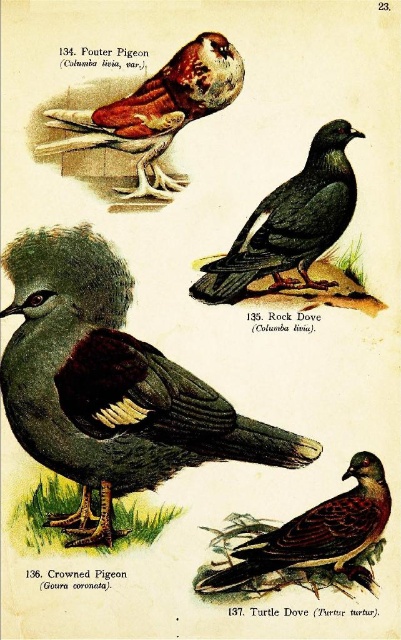
Question: Is shiny black rock dove at center thinner than brown speckled feathered pigeon at lower right?

Choices:
 (A) yes
 (B) no

Answer: (A)

Question: Which object appears closest to the camera in this image?

Choices:
 (A) matte brown feathers at upper left
 (B) shiny blue-green bird at center

Answer: (B)

Question: Which point is farther to the camera?

Choices:
 (A) shiny black rock dove at center
 (B) shiny blue-green bird at center
 (C) brown speckled feathered pigeon at lower right

Answer: (A)

Question: Can you confirm if shiny blue-green bird at center is positioned above brown speckled feathered pigeon at lower right?

Choices:
 (A) yes
 (B) no

Answer: (A)

Question: Can you confirm if shiny blue-green bird at center is smaller than shiny black rock dove at center?

Choices:
 (A) yes
 (B) no

Answer: (B)

Question: Which point is closer to the camera?

Choices:
 (A) shiny black rock dove at center
 (B) shiny blue-green bird at center
 (C) brown speckled feathered pigeon at lower right

Answer: (B)